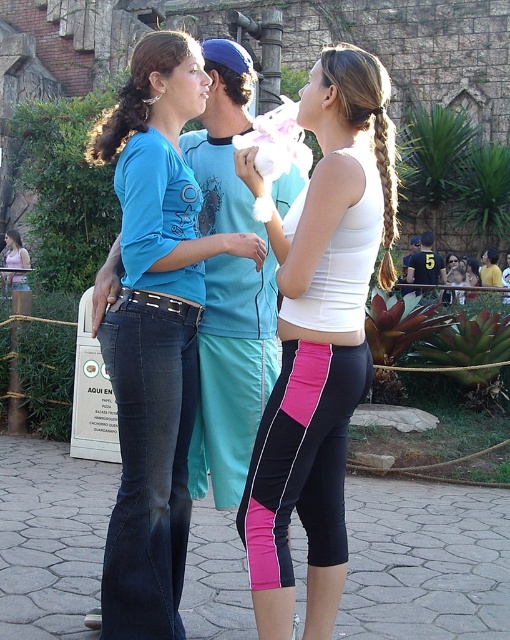
You are a photographer trying to capture a clear shot of the white matte tank top at center and the brown hair at center. Which object is located below the other in the image?

The white matte tank top at center is positioned under brown hair at center, so the tank top is below the hair in the image.

You are a park ranger who needs to ensure visitors are within the safety zone. The safety zone requires that all visitors must be within 5 meters of each other. You see the dark blue denim jeans at left and the brown hair at center. Are these two visitors within the required distance?

The distance between the dark blue denim jeans at left and the brown hair at center is 7.32 meters, which exceeds the 5 meters requirement. Therefore, they are not within the required safety distance.